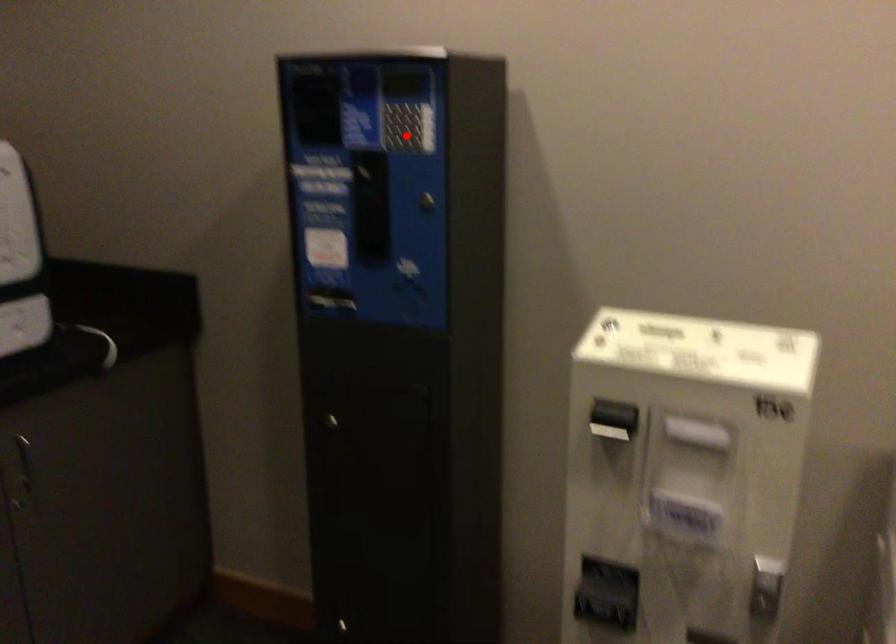
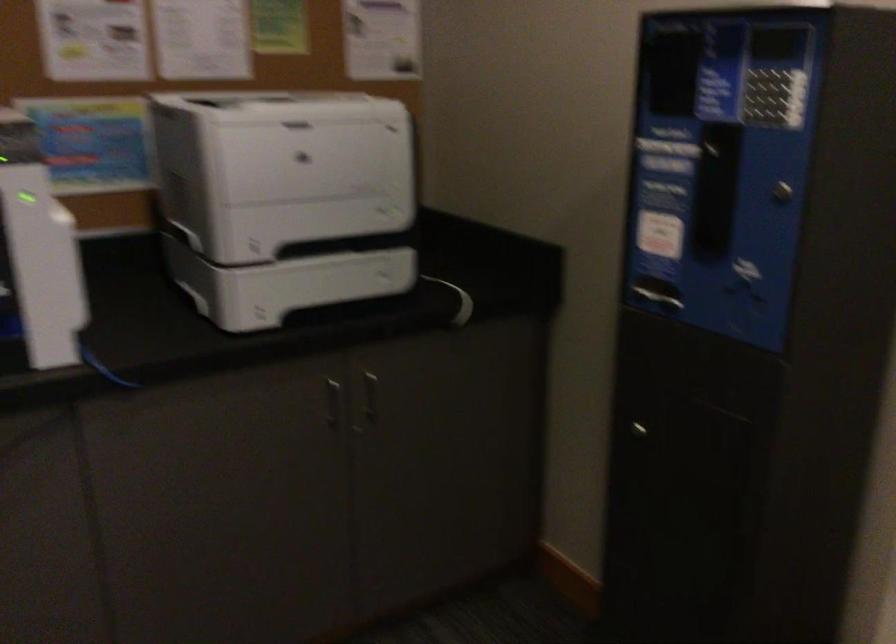
Find the pixel in the second image that matches the highlighted location in the first image.

(765, 106)